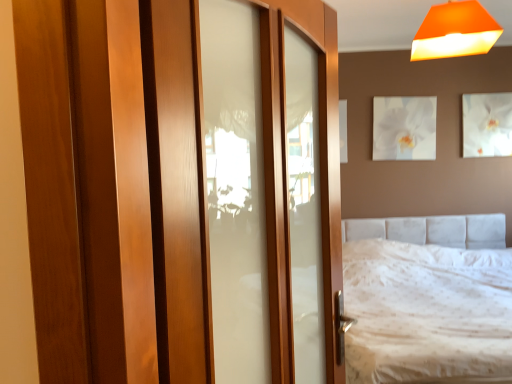
Question: Is there a large distance between white textured bed at center and wooden door at center?

Choices:
 (A) no
 (B) yes

Answer: (B)

Question: Could you tell me if white textured bed at center is facing wooden door at center?

Choices:
 (A) no
 (B) yes

Answer: (A)

Question: Can you confirm if white textured bed at center is taller than wooden door at center?

Choices:
 (A) no
 (B) yes

Answer: (A)

Question: Does white textured bed at center have a smaller size compared to wooden door at center?

Choices:
 (A) no
 (B) yes

Answer: (A)

Question: From a real-world perspective, is white textured bed at center located beneath wooden door at center?

Choices:
 (A) yes
 (B) no

Answer: (A)

Question: Visually, is orange matte lampshade at upper right positioned to the left or to the right of white glossy picture frame at upper right, acting as the 2th picture frame starting from the left?

Choices:
 (A) right
 (B) left

Answer: (B)

Question: Is point (442, 6) closer or farther from the camera than point (465, 107)?

Choices:
 (A) closer
 (B) farther

Answer: (A)

Question: Considering the positions of orange matte lampshade at upper right and white glossy picture frame at upper right, acting as the 2th picture frame starting from the left, in the image, is orange matte lampshade at upper right bigger or smaller than white glossy picture frame at upper right, acting as the 2th picture frame starting from the left,?

Choices:
 (A) small
 (B) big

Answer: (B)

Question: From a real-world perspective, relative to white glossy picture frame at upper right, marked as the first picture frame in a right-to-left arrangement, is orange matte lampshade at upper right vertically above or below?

Choices:
 (A) below
 (B) above

Answer: (B)

Question: From a real-world perspective, is wooden door at center positioned above or below white textured bed at center?

Choices:
 (A) above
 (B) below

Answer: (A)

Question: Would you say wooden door at center is to the left or to the right of white textured bed at center in the picture?

Choices:
 (A) left
 (B) right

Answer: (A)

Question: Looking at their shapes, would you say wooden door at center is wider or thinner than white textured bed at center?

Choices:
 (A) wide
 (B) thin

Answer: (B)

Question: From the image's perspective, is wooden door at center positioned above or below white textured bed at center?

Choices:
 (A) below
 (B) above

Answer: (B)

Question: Do you think orange matte lampshade at upper right is within white glossy picture frame at upper center, the 1th picture frame when ordered from left to right, or outside of it?

Choices:
 (A) outside
 (B) inside

Answer: (A)

Question: Is orange matte lampshade at upper right in front of or behind white glossy picture frame at upper center, the 1th picture frame when ordered from left to right, in the image?

Choices:
 (A) behind
 (B) front

Answer: (B)